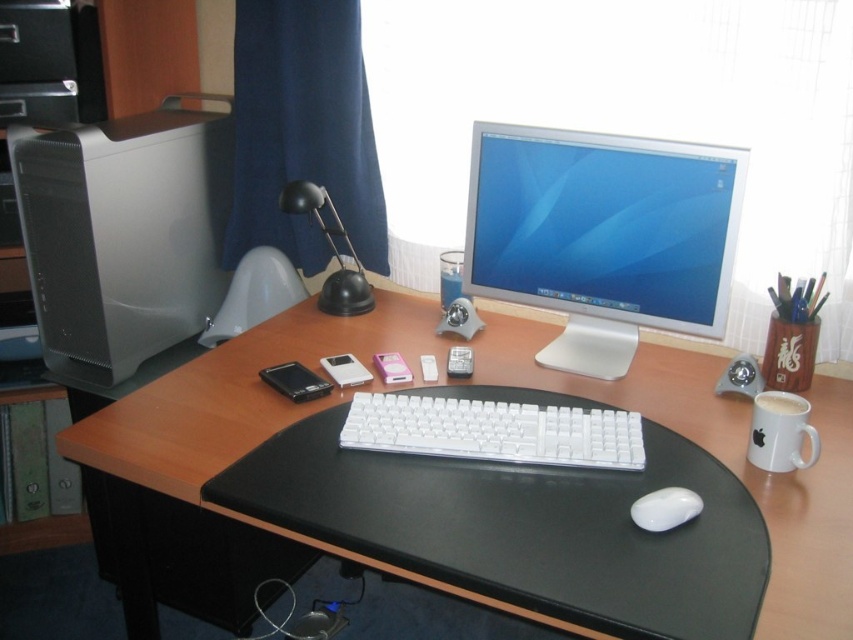
You are setting up a new monitor in your home office. You want to place it where the point at coordinates (604, 225) is located. According to the image, what object is currently occupying that position?

The point at coordinates (604, 225) corresponds to the satin white monitor at center, so the satin white monitor at center is currently occupying that position.

You are setting up a new desk and need to place a 15 cm tall object between the black plastic lamp at center and the white matte mouse at lower center. Can the object fit vertically between them?

The black plastic lamp at center is taller than the white matte mouse at lower center. Since the object is 15 cm tall, it can fit vertically between them as long as there is enough space between their heights. However, the exact vertical clearance isn

You are setting up a new monitor for your home office. The monitor requires a space of at least 20 cm between the existing devices. Can you place it between the black leather mousepad at center and the satin silver desktop computer at left?

The black leather mousepad at center is positioned on the right side of the satin silver desktop computer at left, so there is sufficient space between them to place the monitor as long as the distance meets the 20 cm requirement. However, the exact distance isn not provided, so you should measure the space between the black leather mousepad at center and the satin silver desktop computer at left to confirm.